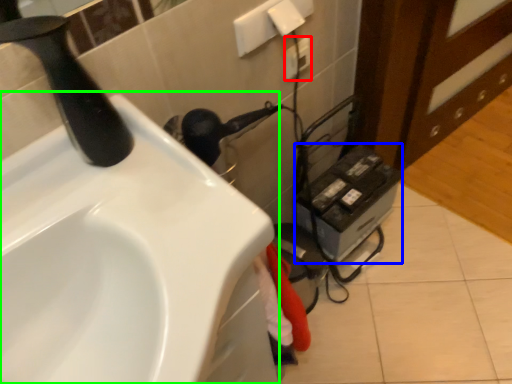
Question: Which is nearer to the electric outlet (highlighted by a red box)? appliance (highlighted by a blue box) or sink (highlighted by a green box).

Choices:
 (A) appliance
 (B) sink

Answer: (A)